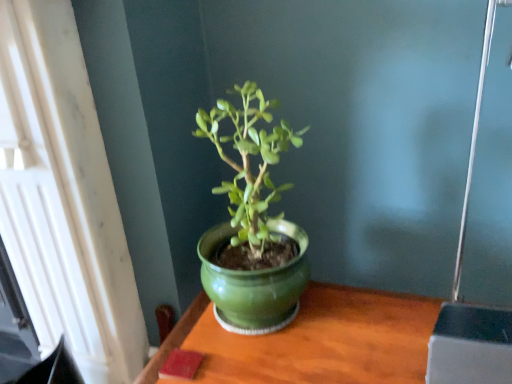
Question: Does point (313, 312) appear closer or farther from the camera than point (230, 114)?

Choices:
 (A) farther
 (B) closer

Answer: (A)

Question: Relative to glossy ceramic pot at center, is green ceramic table at center in front or behind?

Choices:
 (A) front
 (B) behind

Answer: (A)

Question: Which of these objects is positioned closest to the green ceramic table at center?

Choices:
 (A) glossy ceramic pot at center
 (B) white textured window at upper left

Answer: (A)

Question: Estimate the real-world distances between objects in this image. Which object is closer to the white textured window at upper left?

Choices:
 (A) green ceramic table at center
 (B) glossy ceramic pot at center

Answer: (B)